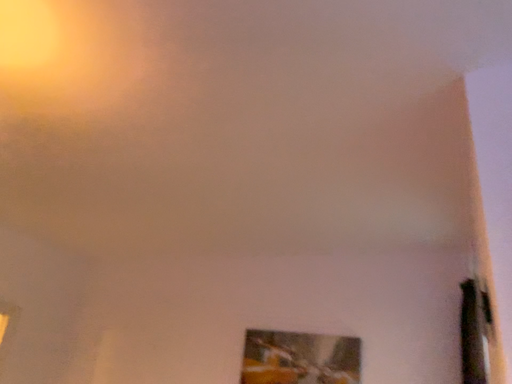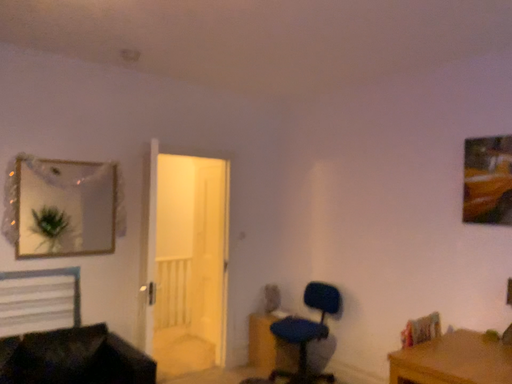
Question: Which way did the camera rotate in the video?

Choices:
 (A) rotated right
 (B) rotated left

Answer: (B)